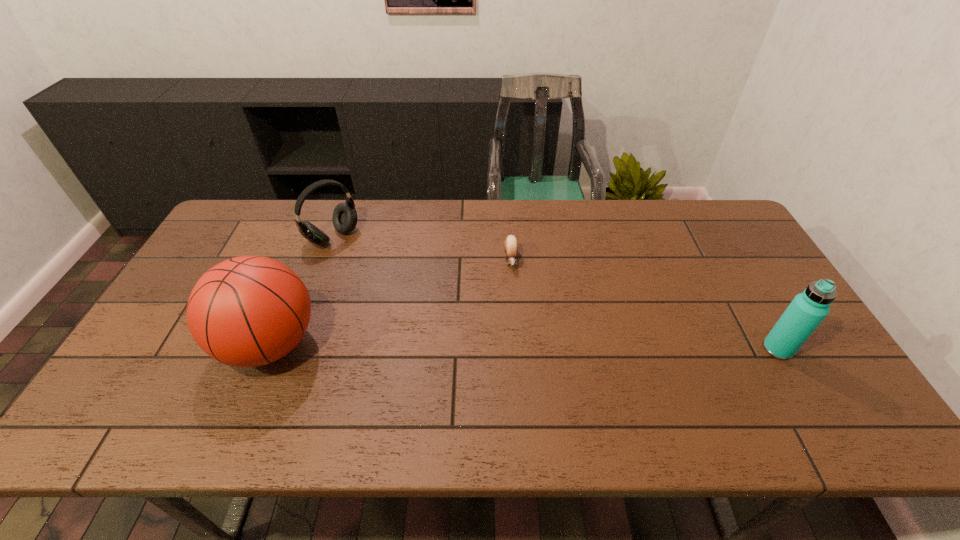
Locate an element on the screen. Image resolution: width=960 pixels, height=540 pixels. basketball is located at coordinates (248, 311).

Image resolution: width=960 pixels, height=540 pixels. I want to click on the rightmost object, so click(x=807, y=310).

Where is `the third tallest object`? the third tallest object is located at coordinates (344, 217).

At what (x,y) coordinates should I click in order to perform the action: click on the shortest object. Please return your answer as a coordinate pair (x, y). Looking at the image, I should click on pos(511,244).

At what (x,y) coordinates should I click in order to perform the action: click on the third object from left to right. Please return your answer as a coordinate pair (x, y). The image size is (960, 540). Looking at the image, I should click on (511, 244).

You are a GUI agent. You are given a task and a screenshot of the screen. Output one action in this format:
    pyautogui.click(x=<x>, y=<y>)
    Task: Click on the free spot located on the right of the basketball
    This screenshot has height=540, width=960.
    Given the screenshot: What is the action you would take?
    pyautogui.click(x=359, y=345)

Locate an element on the screen. vacant region located 0.270m on the left of the rightmost object is located at coordinates (659, 349).

I want to click on vacant space situated 0.200m on the ear cups of the third tallest object, so click(x=385, y=281).

Identify the location of vacant area situated 0.170m on the ear cups of the third tallest object. (379, 276).

Identify the location of free point located 0.260m on the ear cups of the third tallest object. The width and height of the screenshot is (960, 540). (397, 292).